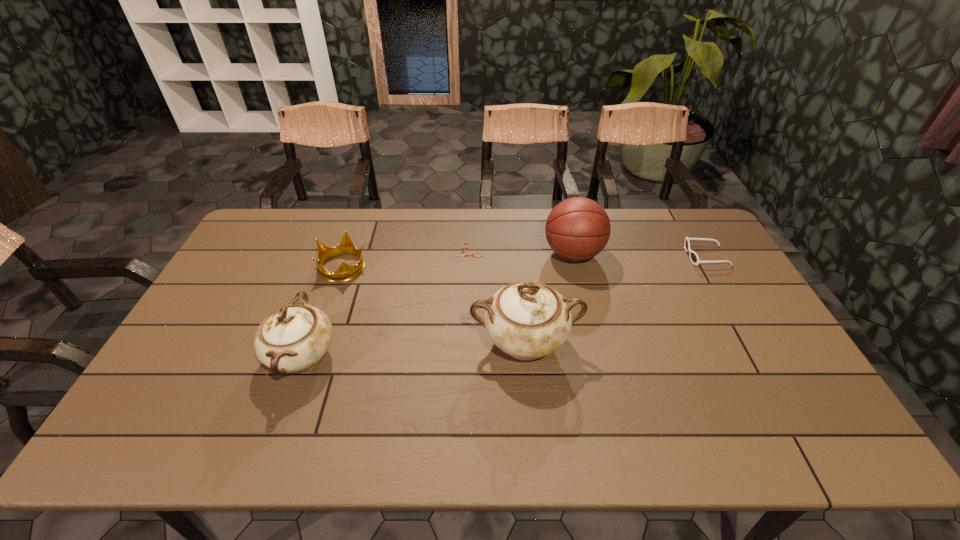
The image size is (960, 540). I want to click on object present at the far right corner, so [x=694, y=258].

In order to click on vacant space at the far edge of the desktop in this screenshot , I will do `click(516, 215)`.

Locate an element on the screen. The image size is (960, 540). free space at the near edge of the desktop is located at coordinates (734, 393).

The width and height of the screenshot is (960, 540). In the image, there is a desktop. What are the coordinates of `vacant space at the left edge` in the screenshot? It's located at (219, 345).

At what (x,y) coordinates should I click in order to perform the action: click on vacant region at the right edge of the desktop. Please return your answer as a coordinate pair (x, y). Image resolution: width=960 pixels, height=540 pixels. Looking at the image, I should click on (746, 359).

The height and width of the screenshot is (540, 960). I want to click on vacant space at the far left corner of the desktop, so click(x=293, y=212).

The image size is (960, 540). I want to click on free space at the far right corner of the desktop, so click(701, 243).

You are a GUI agent. You are given a task and a screenshot of the screen. Output one action in this format:
    pyautogui.click(x=<x>, y=<y>)
    Task: Click on the unoccupied position between the shorter chinaware and the shears
    The width and height of the screenshot is (960, 540).
    Given the screenshot: What is the action you would take?
    pyautogui.click(x=385, y=305)

Where is `vacant area that lies between the sunglasses and the basketball`? This screenshot has width=960, height=540. vacant area that lies between the sunglasses and the basketball is located at coordinates (639, 255).

You are a GUI agent. You are given a task and a screenshot of the screen. Output one action in this format:
    pyautogui.click(x=<x>, y=<y>)
    Task: Click on the empty space between the shorter chinaware and the fourth tallest object
    The height and width of the screenshot is (540, 960).
    Given the screenshot: What is the action you would take?
    pyautogui.click(x=324, y=312)